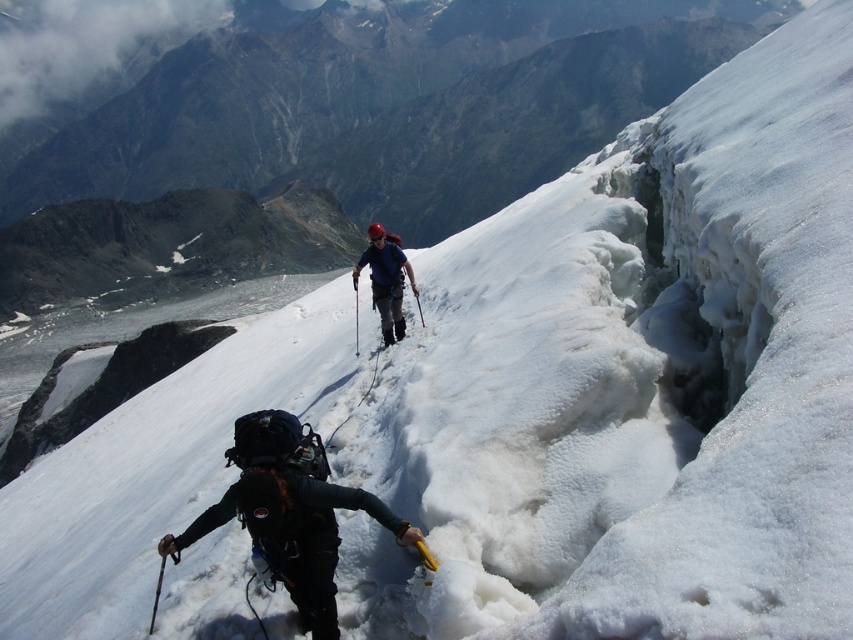
Question: Can you confirm if black nylon backpack at center is bigger than matte blue jacket at center?

Choices:
 (A) yes
 (B) no

Answer: (B)

Question: Is black nylon backpack at center behind matte blue jacket at center?

Choices:
 (A) no
 (B) yes

Answer: (A)

Question: Is black nylon backpack at center to the left of matte blue jacket at center from the viewer's perspective?

Choices:
 (A) no
 (B) yes

Answer: (A)